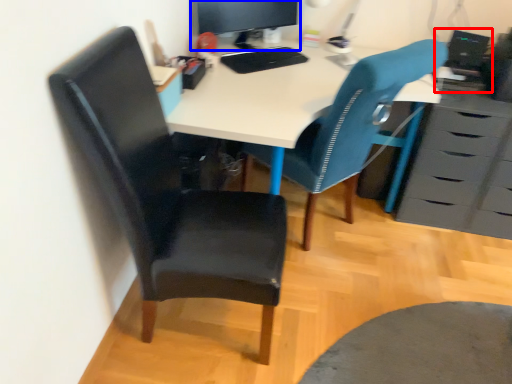
Question: Which object is closer to the camera taking this photo, computer (highlighted by a red box) or computer monitor (highlighted by a blue box)?

Choices:
 (A) computer
 (B) computer monitor

Answer: (B)